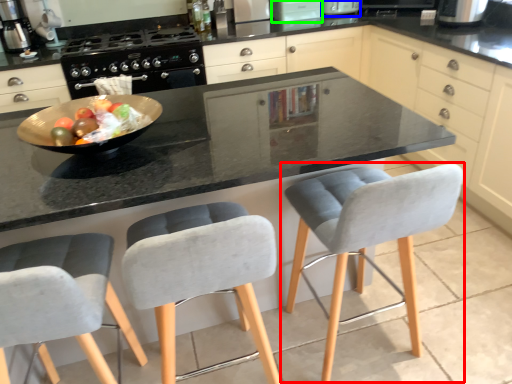
Question: Estimate the real-world distances between objects in this image. Which object is farther from chair (highlighted by a red box), appliance (highlighted by a blue box) or appliance (highlighted by a green box)?

Choices:
 (A) appliance
 (B) appliance

Answer: (A)